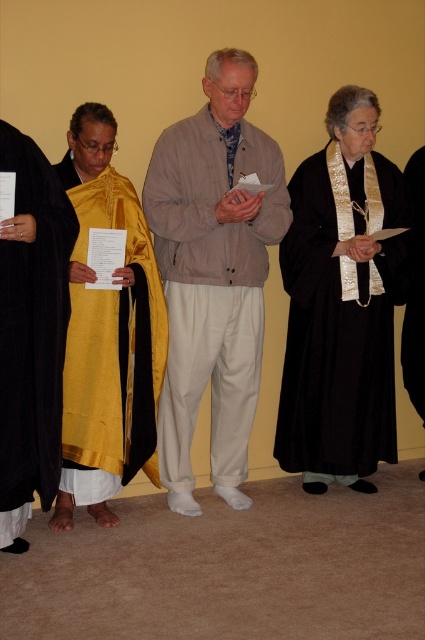
Which is below, light brown cotton jacket at center or black silk robe at right?

light brown cotton jacket at center is lower down.

Does light brown cotton jacket at center have a greater width compared to black silk robe at right?

Yes.

Does point (217, 332) come farther from viewer compared to point (410, 266)?

No, it is in front of (410, 266).

Identify the location of light brown cotton jacket at center. The height and width of the screenshot is (640, 425). (214, 275).

Is black velvet robe at right shorter than black silk robe at right?

In fact, black velvet robe at right may be taller than black silk robe at right.

Does black velvet robe at right have a smaller size compared to black silk robe at right?

Actually, black velvet robe at right might be larger than black silk robe at right.

Identify the location of black velvet robe at right. (340, 316).

Between black matte robe at left and black silk robe at right, which one has less height?

With less height is black silk robe at right.

Is black matte robe at left taller than black silk robe at right?

Yes.

What do you see at coordinates (31, 332) in the screenshot?
I see `black matte robe at left` at bounding box center [31, 332].

You are a GUI agent. You are given a task and a screenshot of the screen. Output one action in this format:
    pyautogui.click(x=<x>, y=<y>)
    Task: Click on the black matte robe at left
    The width and height of the screenshot is (425, 640).
    Given the screenshot: What is the action you would take?
    pyautogui.click(x=31, y=332)